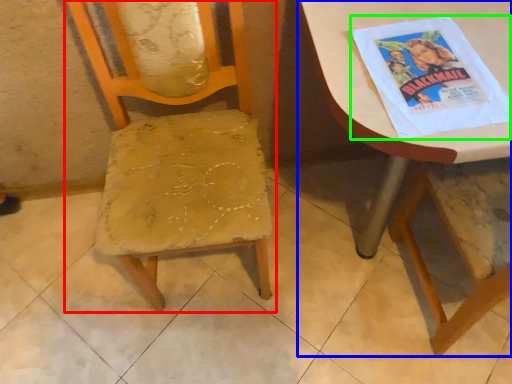
Question: Which object is the farthest from chair (highlighted by a red box)? Choose among these: table (highlighted by a blue box) or comic book (highlighted by a green box).

Choices:
 (A) table
 (B) comic book

Answer: (A)